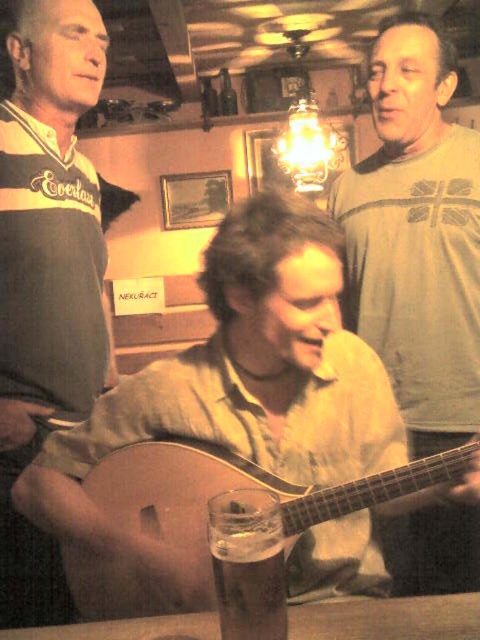
Question: Is dark gray jersey at left above light brown wooden guitar at center?

Choices:
 (A) no
 (B) yes

Answer: (B)

Question: Which of these objects is positioned closest to the dark gray jersey at left?

Choices:
 (A) matte brown guitar at center
 (B) wooden acoustic guitar at center
 (C) light brown wooden guitar at center

Answer: (C)

Question: Does wooden acoustic guitar at center appear over dark gray jersey at left?

Choices:
 (A) no
 (B) yes

Answer: (A)

Question: Which point appears closest to the camera in this image?

Choices:
 (A) (70, 512)
 (B) (39, 440)
 (C) (434, 513)
 (D) (257, 470)

Answer: (A)

Question: Does matte brown guitar at center have a larger size compared to light brown wooden guitar at center?

Choices:
 (A) no
 (B) yes

Answer: (B)

Question: Which point is farther from the camera taking this photo?

Choices:
 (A) (292, 568)
 (B) (88, 266)
 (C) (404, 52)

Answer: (C)